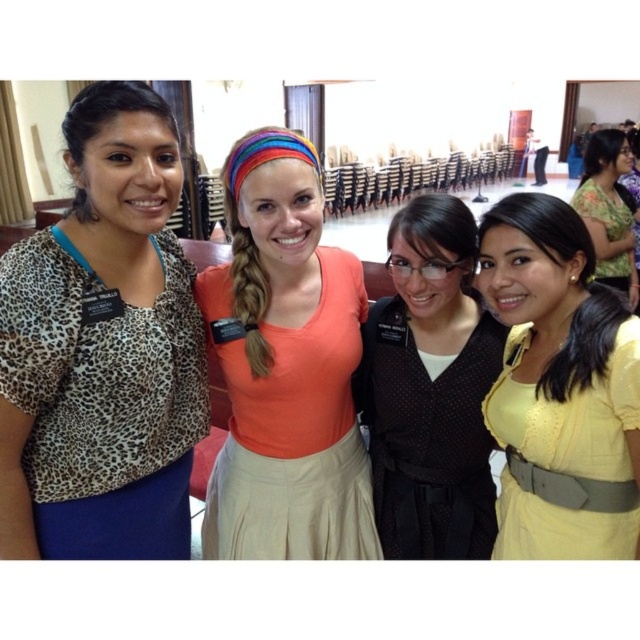
In the scene shown: You are a photographer setting up for a group photo in a large hall with rows of dark chairs. You need to ensure all subjects are within the camera frame. The subjects include the leopard print blouse at left and the orange matte shirt at center. Given that your camera has a maximum horizontal framing range of 10 inches, can both subjects fit within the frame?

The distance between the leopard print blouse at left and the orange matte shirt at center is 9.86 inches, which is within the camera frame limit of 10 inches. Therefore, both subjects can fit within the frame.

You are organizing a photoshoot and need to arrange two outfits for a catalog. The leopard print blouse at left and the matte black vest at center are available. Based on their positions in the image, which outfit should be placed on the model on the left side of the catalog layout?

The leopard print blouse at left should be placed on the model on the left side of the catalog layout because it is already positioned on the left side of the matte black vest at center in the original image.

You are standing at the entrance of the hall and see the yellow matte dress at center and the floral fabric dress at upper right. Which one is closer to you?

The yellow matte dress at center is 4.66 feet away from the floral fabric dress at upper right, so the one closer to you would depend on your position. However, since the yellow matte dress is at the center and the floral one is at upper right, typically the center might be closer if you are facing the front. But the description only states distance between them, not their relation to you. Without knowing your exact position, we can only state their separation distance. Therefore, neither is closer based on